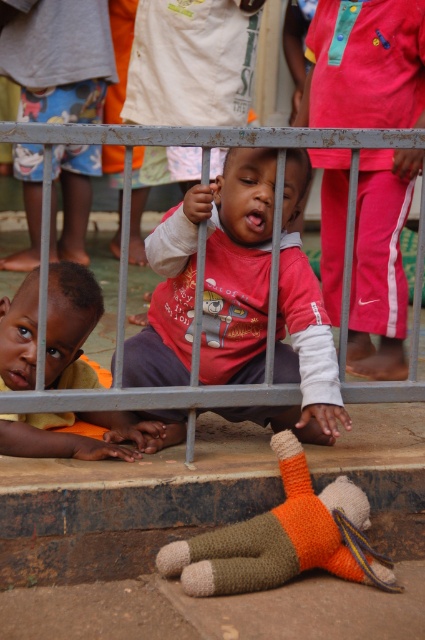
Between knitted orange doll at lower center and orange fabric shirt at lower left, which one appears on the right side from the viewer's perspective?

knitted orange doll at lower center

Is point (190, 552) farther from camera compared to point (112, 435)?

No, (190, 552) is closer to viewer.

The image size is (425, 640). I want to click on knitted orange doll at lower center, so click(283, 538).

You are a GUI agent. You are given a task and a screenshot of the screen. Output one action in this format:
    pyautogui.click(x=<x>, y=<y>)
    Task: Click on the matte red shirt at center
    The image size is (425, 640).
    Given the screenshot: What is the action you would take?
    pyautogui.click(x=235, y=264)

Between matte red shirt at center and orange fabric shirt at lower left, which one has less height?

orange fabric shirt at lower left

Which is in front, point (306, 266) or point (73, 284)?

Positioned in front is point (73, 284).

Locate an element on the screen. The width and height of the screenshot is (425, 640). matte red shirt at center is located at coordinates (235, 264).

Between point (252, 380) and point (193, 550), which one is positioned behind?

The point (252, 380) is more distant.

Can you confirm if matte red shirt at center is smaller than knitted orange doll at lower center?

No.

Is point (226, 243) closer to viewer compared to point (238, 579)?

That is False.

At what (x,y) coordinates should I click in order to perform the action: click on matte red shirt at center. Please return your answer as a coordinate pair (x, y). Looking at the image, I should click on (235, 264).